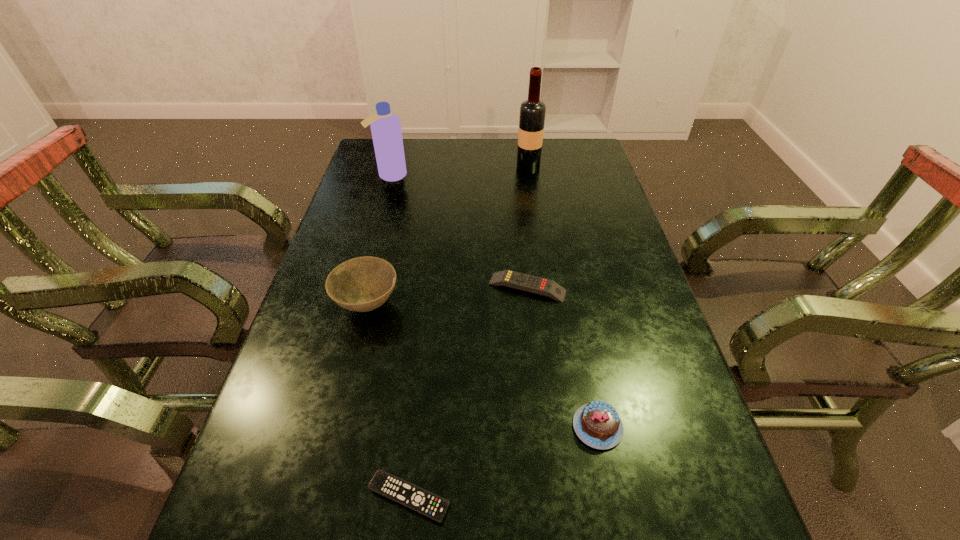
Image resolution: width=960 pixels, height=540 pixels. In order to click on empty location between the tallest object and the bowl in this screenshot , I will do `click(447, 236)`.

You are a GUI agent. You are given a task and a screenshot of the screen. Output one action in this format:
    pyautogui.click(x=<x>, y=<y>)
    Task: Click on the vacant area between the nearer remote control and the bowl
    Image resolution: width=960 pixels, height=540 pixels.
    Given the screenshot: What is the action you would take?
    pyautogui.click(x=388, y=401)

The image size is (960, 540). Find the location of `free spot between the second nearest object and the bowl`. free spot between the second nearest object and the bowl is located at coordinates (483, 366).

Find the location of a particular element. The height and width of the screenshot is (540, 960). object that is the third closest to the bowl is located at coordinates (597, 424).

The width and height of the screenshot is (960, 540). What are the coordinates of `the closest object to the bowl` in the screenshot? It's located at (521, 281).